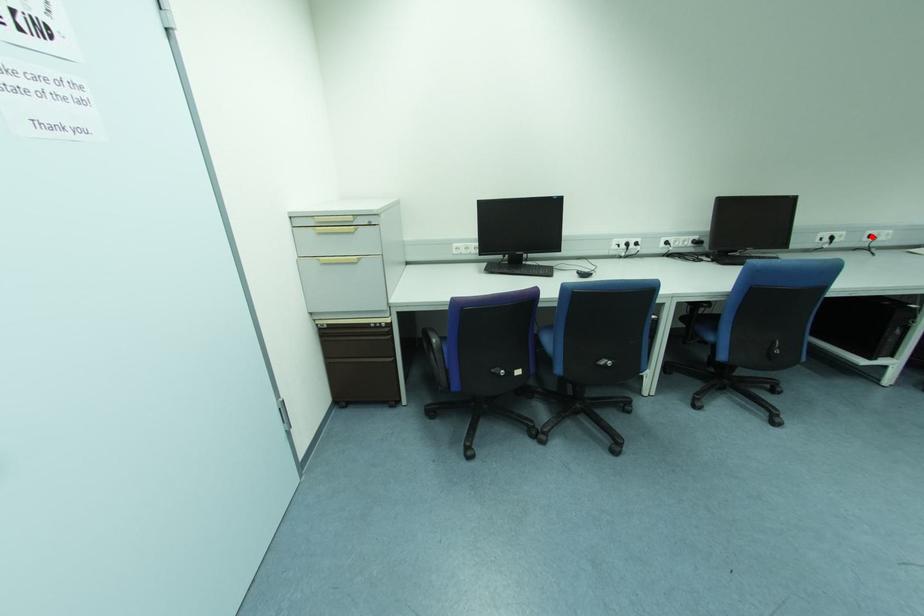
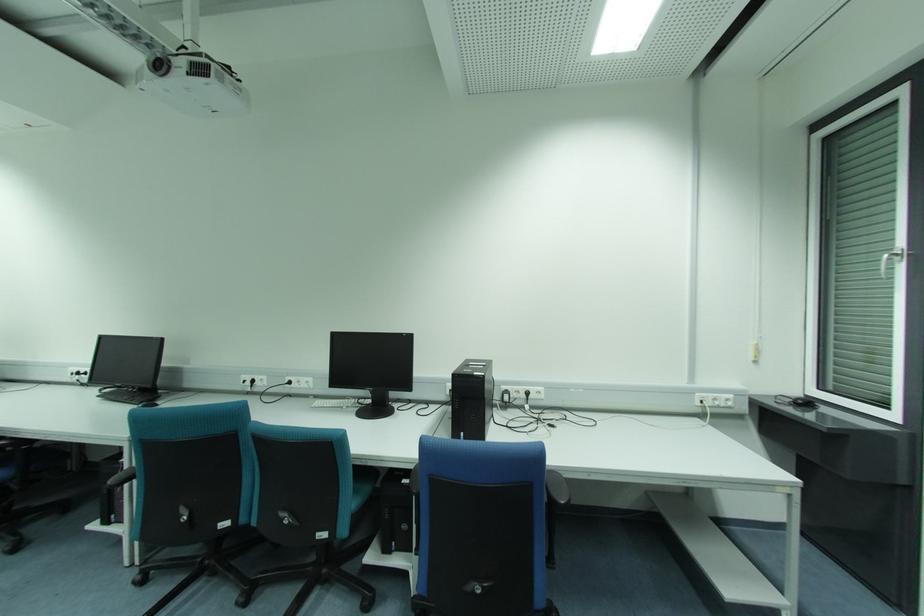
In the second image, find the point that corresponds to the highlighted location in the first image.

(289, 383)